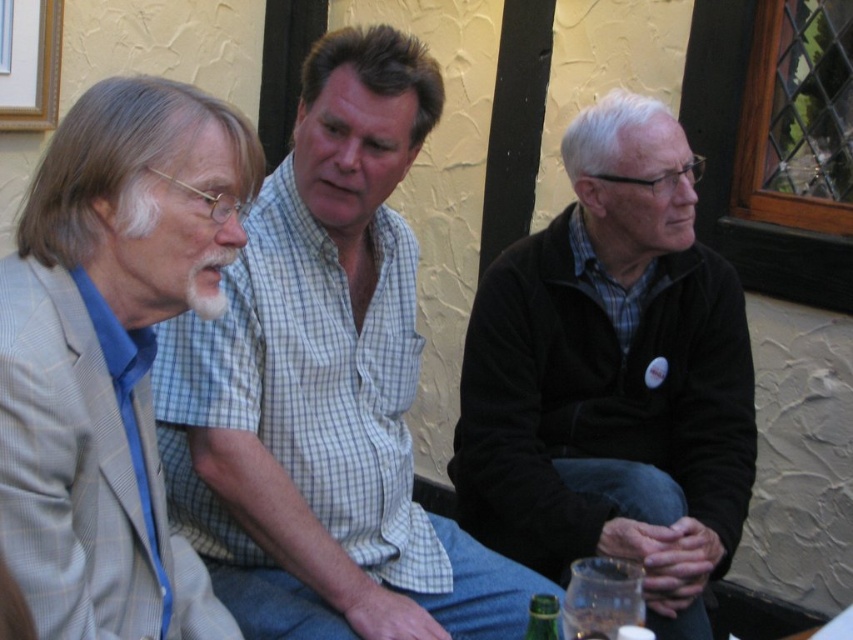
Question: Based on their relative distances, which object is farther from the light gray suit at left?

Choices:
 (A) black fleece jacket at center
 (B) brushed metal picture frame at upper left
 (C) light brown checkered shirt at center

Answer: (B)

Question: From the image, what is the correct spatial relationship of black fleece jacket at center in relation to light gray suit at left?

Choices:
 (A) above
 (B) below

Answer: (A)

Question: Is black fleece jacket at center closer to camera compared to light gray suit at left?

Choices:
 (A) no
 (B) yes

Answer: (A)

Question: Which object is closer to the camera taking this photo?

Choices:
 (A) black fleece jacket at center
 (B) light brown checkered shirt at center

Answer: (B)

Question: Is black fleece jacket at center bigger than brushed metal picture frame at upper left?

Choices:
 (A) no
 (B) yes

Answer: (B)

Question: Which of the following is the farthest from the observer?

Choices:
 (A) brushed metal picture frame at upper left
 (B) light brown checkered shirt at center

Answer: (A)